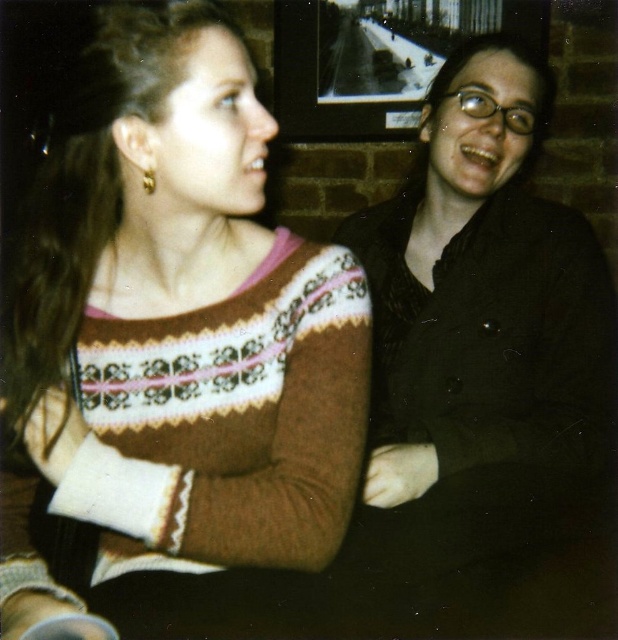
Can you confirm if brown knitted sweater at upper left is positioned below gold metallic earring at upper left?

Correct, brown knitted sweater at upper left is located below gold metallic earring at upper left.

Does brown knitted sweater at upper left have a smaller size compared to gold metallic earring at upper left?

No, brown knitted sweater at upper left is not smaller than gold metallic earring at upper left.

Who is more distant from viewer, (20, 260) or (154, 184)?

The point (20, 260) is behind.

Where is `brown knitted sweater at upper left`? The image size is (618, 640). brown knitted sweater at upper left is located at coordinates pyautogui.click(x=171, y=337).

Does matte black jacket at center have a greater height compared to gold metallic earring at upper left?

Correct, matte black jacket at center is much taller as gold metallic earring at upper left.

Can you confirm if matte black jacket at center is positioned above gold metallic earring at upper left?

Actually, matte black jacket at center is below gold metallic earring at upper left.

Image resolution: width=618 pixels, height=640 pixels. What do you see at coordinates (476, 340) in the screenshot? I see `matte black jacket at center` at bounding box center [476, 340].

The height and width of the screenshot is (640, 618). In order to click on matte black jacket at center in this screenshot , I will do `click(476, 340)`.

Between point (69, 225) and point (478, 566), which one is positioned behind?

Positioned behind is point (478, 566).

The width and height of the screenshot is (618, 640). I want to click on brown knitted sweater at upper left, so click(171, 337).

This screenshot has height=640, width=618. What are the coordinates of `brown knitted sweater at upper left` in the screenshot? It's located at (171, 337).